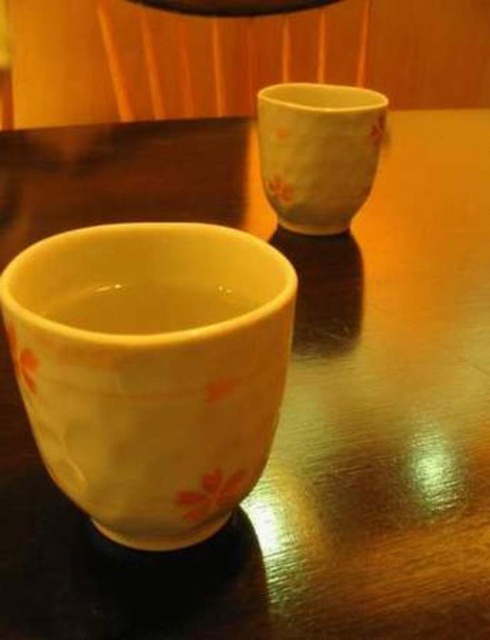
Question: Is yellow glazed cup at lower left above matte ceramic cup at upper right?

Choices:
 (A) yes
 (B) no

Answer: (B)

Question: Is yellow glazed cup at lower left bigger than matte ceramic cup at upper right?

Choices:
 (A) yes
 (B) no

Answer: (B)

Question: Among these points, which one is farthest from the camera?

Choices:
 (A) (128, 512)
 (B) (359, 90)

Answer: (B)

Question: From the image, what is the correct spatial relationship of yellow glazed cup at lower left in relation to matte ceramic cup at upper right?

Choices:
 (A) below
 (B) above

Answer: (A)

Question: Which object is farther from the camera taking this photo?

Choices:
 (A) matte ceramic cup at upper right
 (B) yellow glazed cup at lower left

Answer: (A)